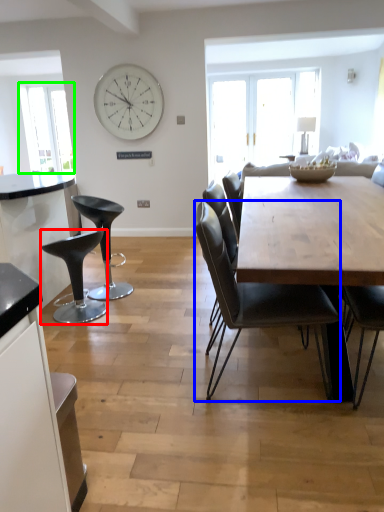
Question: Estimate the real-world distances between objects in this image. Which object is closer to stool (highlighted by a red box), chair (highlighted by a blue box) or window screen (highlighted by a green box)?

Choices:
 (A) chair
 (B) window screen

Answer: (A)